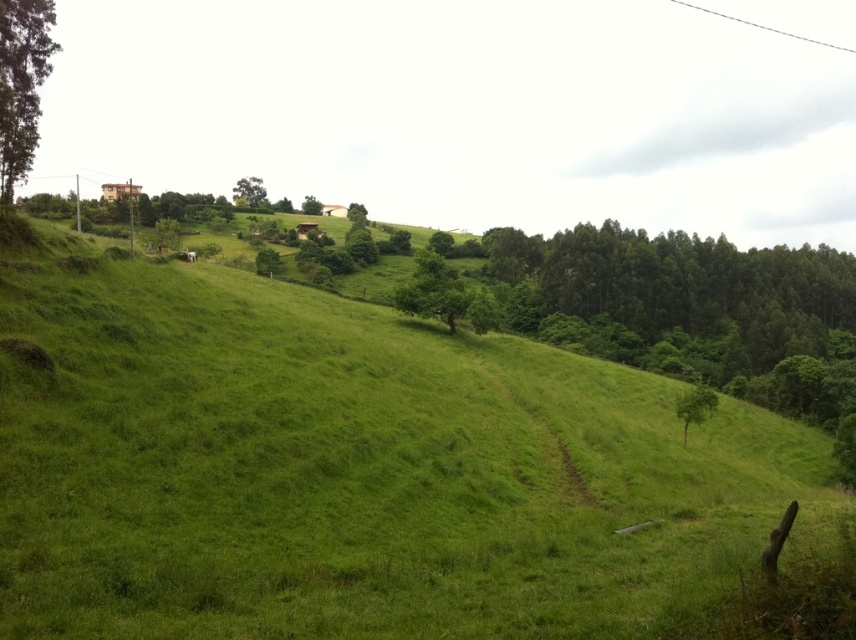
Measure the distance between green grassy hillside at center and green leafy tree at center.

1709.01 feet

Based on the photo, which is below, green grassy hillside at center or green leafy tree at center?

green grassy hillside at center is below.

Which is behind, point (229, 566) or point (312, 198)?

The point (312, 198) is behind.

At what (x,y) coordinates should I click in order to perform the action: click on green grassy hillside at center. Please return your answer as a coordinate pair (x, y). Looking at the image, I should click on (352, 468).

Does green leafy tree at right have a greater height compared to green leafy tree at center?

No.

Is green leafy tree at right further to camera compared to green leafy tree at center?

No.

I want to click on green leafy tree at right, so click(694, 406).

Between green grassy hillside at center and green leafy tree at upper center, which one appears on the right side from the viewer's perspective?

Positioned to the right is green grassy hillside at center.

Can you confirm if green grassy hillside at center is taller than green leafy tree at upper center?

A: No, green grassy hillside at center is not taller than green leafy tree at upper center.

What do you see at coordinates (352, 468) in the screenshot? I see `green grassy hillside at center` at bounding box center [352, 468].

At what (x,y) coordinates should I click in order to perform the action: click on green grassy hillside at center. Please return your answer as a coordinate pair (x, y). The height and width of the screenshot is (640, 856). Looking at the image, I should click on (352, 468).